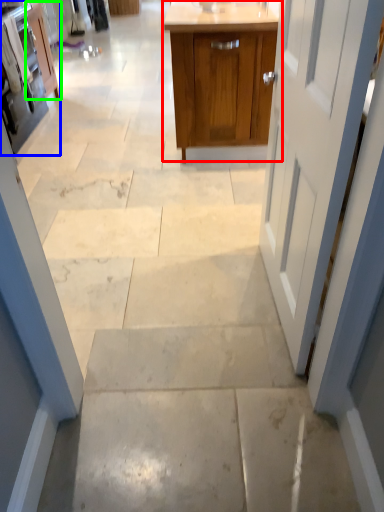
Question: Based on their relative distances, which object is nearer to cabinetry (highlighted by a red box)? Choose from cabinetry (highlighted by a blue box) and cabinetry (highlighted by a green box).

Choices:
 (A) cabinetry
 (B) cabinetry

Answer: (A)